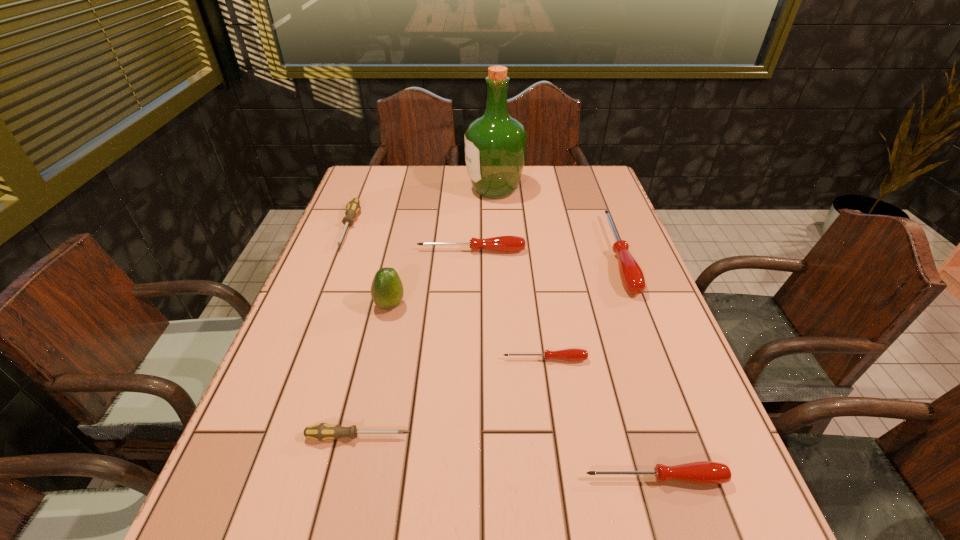
Locate an element on the screen. The height and width of the screenshot is (540, 960). free region located on the right of the third smallest red screwdriver is located at coordinates (590, 251).

Identify the location of vacant area situated 0.370m at the tip of the farther gray screwdriver. The height and width of the screenshot is (540, 960). (298, 359).

The image size is (960, 540). I want to click on vacant position located on the back of the nearest screwdriver, so click(x=630, y=394).

You are a GUI agent. You are given a task and a screenshot of the screen. Output one action in this format:
    pyautogui.click(x=<x>, y=<y>)
    Task: Click on the free point located 0.290m at the tip of the right gray screwdriver
    
    Given the screenshot: What is the action you would take?
    pyautogui.click(x=564, y=437)

You are a GUI agent. You are given a task and a screenshot of the screen. Output one action in this format:
    pyautogui.click(x=<x>, y=<y>)
    Task: Click on the vacant space located on the left of the shortest screwdriver
    The image size is (960, 540).
    Given the screenshot: What is the action you would take?
    pyautogui.click(x=348, y=359)

Where is `object positioned at the far edge`? object positioned at the far edge is located at coordinates (495, 144).

The height and width of the screenshot is (540, 960). In order to click on free space at the far edge of the desktop in this screenshot , I will do `click(478, 199)`.

You are a GUI agent. You are given a task and a screenshot of the screen. Output one action in this format:
    pyautogui.click(x=<x>, y=<y>)
    Task: Click on the vacant space at the left edge of the desktop
    The width and height of the screenshot is (960, 540).
    Given the screenshot: What is the action you would take?
    pyautogui.click(x=343, y=334)

The image size is (960, 540). In order to click on vacant region at the right edge in this screenshot , I will do `click(577, 225)`.

The width and height of the screenshot is (960, 540). In the image, there is a desktop. In order to click on vacant space at the near right corner in this screenshot , I will do `click(730, 534)`.